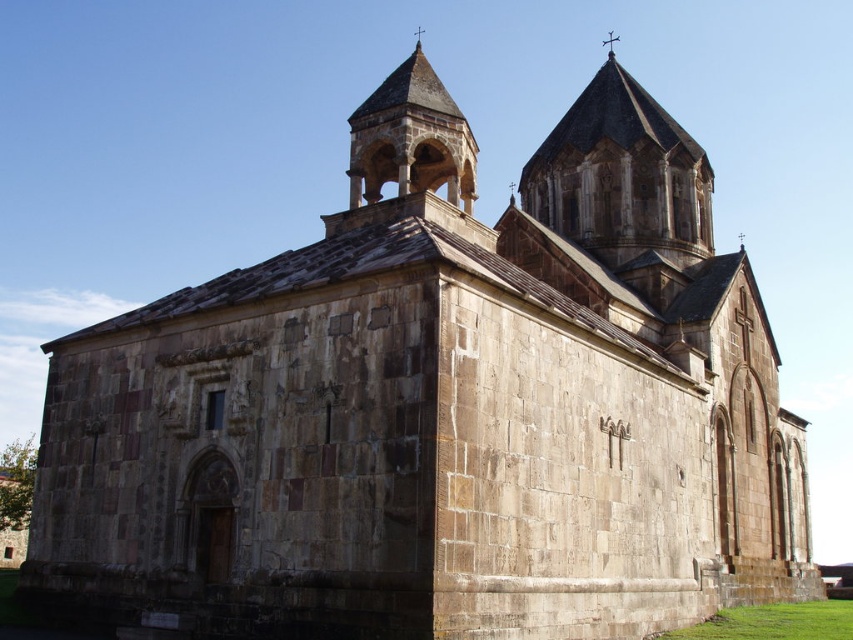
Question: Which of the following is the farthest from the observer?

Choices:
 (A) (613, 54)
 (B) (625, 84)
 (C) (433, 120)

Answer: (A)

Question: Which object appears closest to the camera in this image?

Choices:
 (A) polished metal cross at upper center
 (B) stone arched tower at center
 (C) stone tower at upper center

Answer: (B)

Question: Is stone tower at upper center to the left of stone arched tower at center from the viewer's perspective?

Choices:
 (A) no
 (B) yes

Answer: (A)

Question: Can you confirm if stone tower at upper center is positioned to the left of stone arched tower at center?

Choices:
 (A) yes
 (B) no

Answer: (B)

Question: Can you confirm if stone tower at upper center is positioned to the left of polished metal cross at upper center?

Choices:
 (A) yes
 (B) no

Answer: (A)

Question: Among these points, which one is farthest from the camera?

Choices:
 (A) (612, 36)
 (B) (460, 156)

Answer: (A)